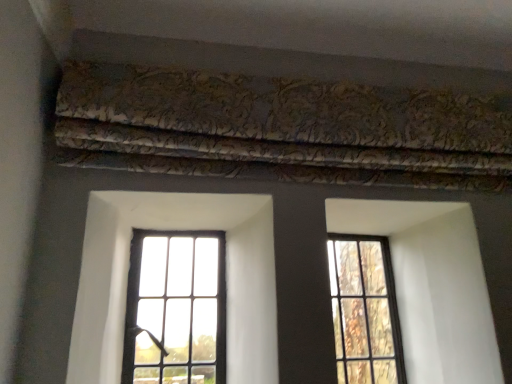
Question: In terms of size, does gold-patterned fabric at upper center appear bigger or smaller than clear glass window at center, placed as the 2th window when sorted from right to left?

Choices:
 (A) big
 (B) small

Answer: (A)

Question: Considering the positions of point (409, 177) and point (151, 352), is point (409, 177) closer or farther from the camera than point (151, 352)?

Choices:
 (A) farther
 (B) closer

Answer: (B)

Question: Which object is the closest to the gold-patterned fabric at upper center?

Choices:
 (A) clear glass window at center, which is counted as the 1th window, starting from the left
 (B) clear glass window at right, acting as the 2th window starting from the left

Answer: (B)

Question: Estimate the real-world distances between objects in this image. Which object is closer to the clear glass window at right, acting as the 2th window starting from the left?

Choices:
 (A) gold-patterned fabric at upper center
 (B) clear glass window at center, placed as the 2th window when sorted from right to left

Answer: (B)